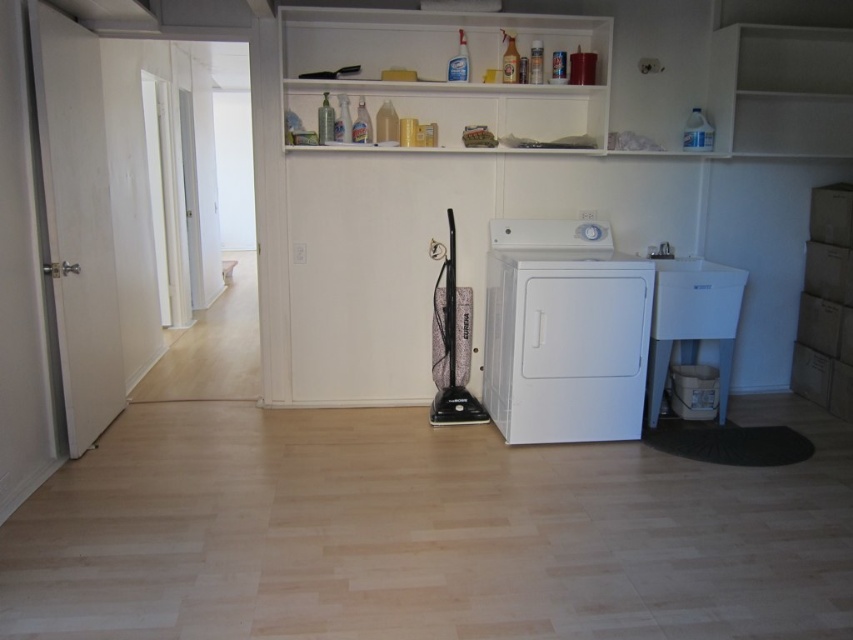
You are a delivery person who just arrived with a new microwave that measures 36 inches in width. You need to place it in the laundry room. Is there enough space between the white matte washing machine at center and the white matte shelf at upper center to fit the microwave horizontally?

The distance between the white matte washing machine at center and the white matte shelf at upper center is 38.96 inches. Since the microwave is 36 inches wide, there is enough space to fit it horizontally between them.

You are standing in the laundry room and need to locate the white matte washing machine at center. Based on the coordinates provided, where would you find it?

The white matte washing machine at center is located at point (564, 332).

You need to place a new laundry basket that is 1.2 meters wide between the white matte washing machine at center and the white matte shelf at upper center. Based on their widths, will the basket fit between them?

The white matte washing machine at center is narrower than the white matte shelf at upper center. However, the question asks about placing the basket between them, which likely refers to the space between their positions rather than their widths. Since the shelf is above the washing machine, there isn not a horizontal space between them for the basket to fit. Therefore, the basket cannot be placed between them regardless of their widths.